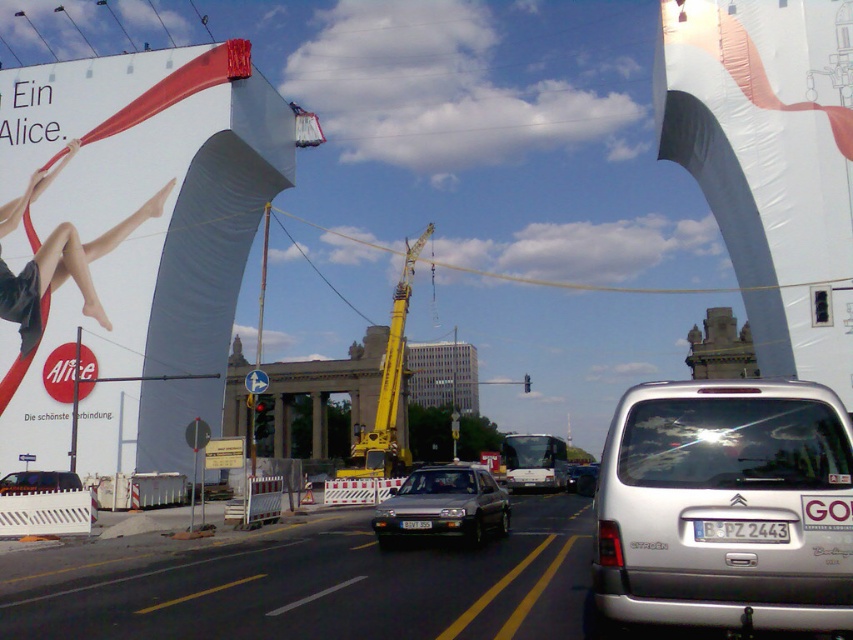
Between white matte van at center and black plastic license plate at center, which one has more height?

white matte van at center is taller.

Does point (509, 477) come behind point (421, 518)?

Yes, it is.

Find the location of `white matte van at center`. white matte van at center is located at coordinates (534, 477).

Can you confirm if matte white fabric at upper left is positioned above matte black van at center?

Yes, matte white fabric at upper left is above matte black van at center.

Is matte white fabric at upper left wider than matte black van at center?

Correct, the width of matte white fabric at upper left exceeds that of matte black van at center.

Which is in front, point (45, 243) or point (28, 483)?

Point (28, 483)

Locate an element on the screen. matte white fabric at upper left is located at coordinates (64, 269).

Does satin silver sedan at center have a greater width compared to white plastic license plate at center?

Yes, satin silver sedan at center is wider than white plastic license plate at center.

Is point (476, 540) positioned after point (750, 536)?

Yes.

The image size is (853, 640). I want to click on satin silver sedan at center, so click(x=444, y=506).